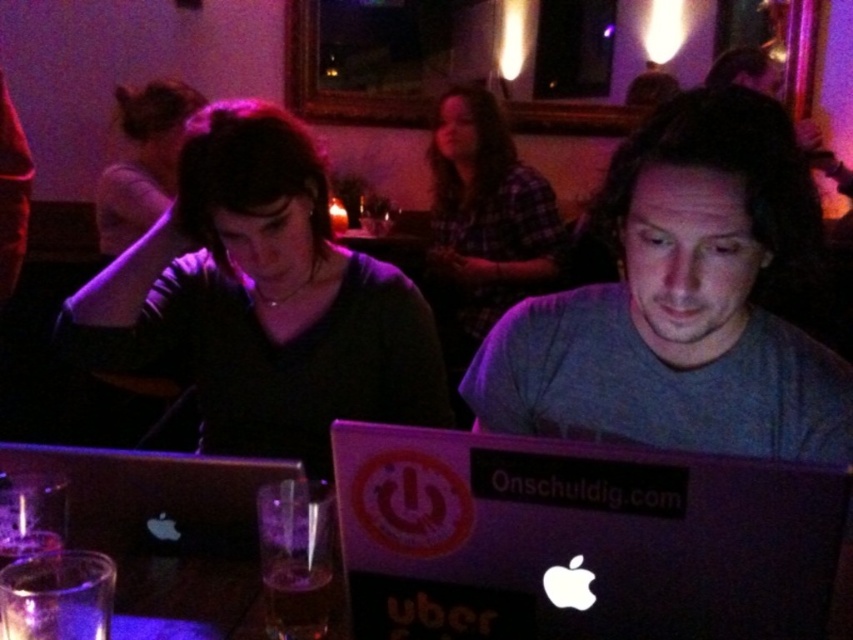
Is plaid fabric shirt at center thinner than matte black shirt at upper center?

Indeed, plaid fabric shirt at center has a lesser width compared to matte black shirt at upper center.

The height and width of the screenshot is (640, 853). In order to click on plaid fabric shirt at center in this screenshot , I will do `click(485, 218)`.

Measure the distance between point (514, 148) and camera.

Point (514, 148) and camera are 2.78 meters apart.

Where is `plaid fabric shirt at center`? The height and width of the screenshot is (640, 853). plaid fabric shirt at center is located at coordinates (485, 218).

Who is positioned more to the right, matte black shirt at center or plaid fabric shirt at center?

From the viewer's perspective, plaid fabric shirt at center appears more on the right side.

The height and width of the screenshot is (640, 853). What are the coordinates of `matte black shirt at center` in the screenshot? It's located at (262, 300).

From the picture: Between silver metallic laptop at center and matte black shirt at upper center, which one has less height?

Standing shorter between the two is silver metallic laptop at center.

Measure the distance between silver metallic laptop at center and matte black shirt at upper center.

silver metallic laptop at center is 5.65 feet from matte black shirt at upper center.

Where is `silver metallic laptop at center`? This screenshot has height=640, width=853. silver metallic laptop at center is located at coordinates (164, 520).

The width and height of the screenshot is (853, 640). I want to click on silver metallic laptop at center, so click(164, 520).